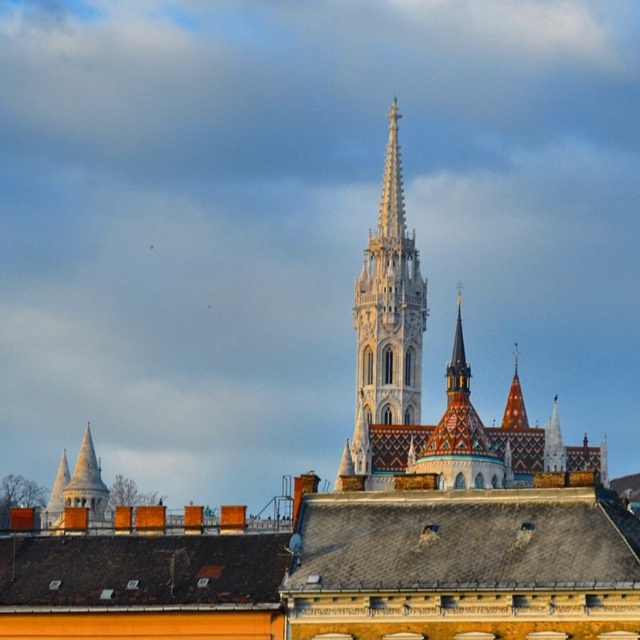
Is white stone spire at center closer to the viewer compared to white stone tower at lower left?

No, white stone spire at center is behind white stone tower at lower left.

Does white stone spire at center have a greater width compared to white stone tower at lower left?

Incorrect, white stone spire at center's width does not surpass white stone tower at lower left's.

Is point (384, 344) more distant than point (72, 506)?

Yes, point (384, 344) is farther from viewer.

Find the location of a particular element. white stone spire at center is located at coordinates (387, 324).